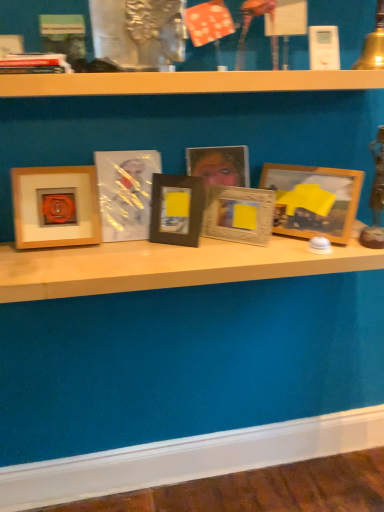
Question: Could you tell me if wooden photo frame at center, the 3th picture frame in the right-to-left sequence, is facing matte plastic picture frame at center, marked as the 2th picture frame in a left-to-right arrangement?

Choices:
 (A) yes
 (B) no

Answer: (B)

Question: Considering the relative sizes of wooden photo frame at center, the 3th picture frame in the right-to-left sequence, and matte plastic picture frame at center, the fifth picture frame from the right, in the image provided, is wooden photo frame at center, the 3th picture frame in the right-to-left sequence, taller than matte plastic picture frame at center, the fifth picture frame from the right,?

Choices:
 (A) yes
 (B) no

Answer: (A)

Question: Considering the relative sizes of wooden photo frame at center, the 3th picture frame in the right-to-left sequence, and matte plastic picture frame at center, the fifth picture frame from the right, in the image provided, is wooden photo frame at center, the 3th picture frame in the right-to-left sequence, thinner than matte plastic picture frame at center, the fifth picture frame from the right,?

Choices:
 (A) yes
 (B) no

Answer: (B)

Question: Is the position of wooden photo frame at center, the 3th picture frame in the right-to-left sequence, less distant than that of matte plastic picture frame at center, the fifth picture frame from the right?

Choices:
 (A) no
 (B) yes

Answer: (A)

Question: From a real-world perspective, is wooden photo frame at center, acting as the fourth picture frame starting from the left, positioned over matte plastic picture frame at center, the fifth picture frame from the right, based on gravity?

Choices:
 (A) yes
 (B) no

Answer: (A)

Question: Does point (173, 175) appear closer or farther from the camera than point (211, 82)?

Choices:
 (A) closer
 (B) farther

Answer: (B)

Question: From a real-world perspective, is black matte picture frame at center, which ranks as the third picture frame in left-to-right order, above or below wooden shelf at upper center?

Choices:
 (A) above
 (B) below

Answer: (B)

Question: Considering the positions of black matte picture frame at center, which ranks as the third picture frame in left-to-right order, and wooden shelf at upper center in the image, is black matte picture frame at center, which ranks as the third picture frame in left-to-right order, wider or thinner than wooden shelf at upper center?

Choices:
 (A) thin
 (B) wide

Answer: (A)

Question: Relative to wooden shelf at upper center, is black matte picture frame at center, which is the 4th picture frame in right-to-left order, in front or behind?

Choices:
 (A) behind
 (B) front

Answer: (A)

Question: Is hardcover book at upper left bigger or smaller than wooden picture frame at center, the fifth picture frame from the left?

Choices:
 (A) big
 (B) small

Answer: (A)

Question: From a real-world perspective, relative to wooden picture frame at center, the fifth picture frame from the left, is hardcover book at upper left vertically above or below?

Choices:
 (A) below
 (B) above

Answer: (B)

Question: Considering the positions of point (39, 58) and point (248, 236), is point (39, 58) closer or farther from the camera than point (248, 236)?

Choices:
 (A) closer
 (B) farther

Answer: (A)

Question: From their relative heights in the image, would you say hardcover book at upper left is taller or shorter than wooden picture frame at center, the fifth picture frame from the left?

Choices:
 (A) short
 (B) tall

Answer: (A)

Question: Considering the relative positions of wooden picture frame at center, the fifth picture frame from the left, and black matte picture frame at center, which is the 4th picture frame in right-to-left order, in the image provided, is wooden picture frame at center, the fifth picture frame from the left, to the left or to the right of black matte picture frame at center, which is the 4th picture frame in right-to-left order,?

Choices:
 (A) right
 (B) left

Answer: (A)

Question: From a real-world perspective, relative to black matte picture frame at center, which ranks as the third picture frame in left-to-right order, is wooden picture frame at center, the 2th picture frame when ordered from right to left, vertically above or below?

Choices:
 (A) above
 (B) below

Answer: (B)